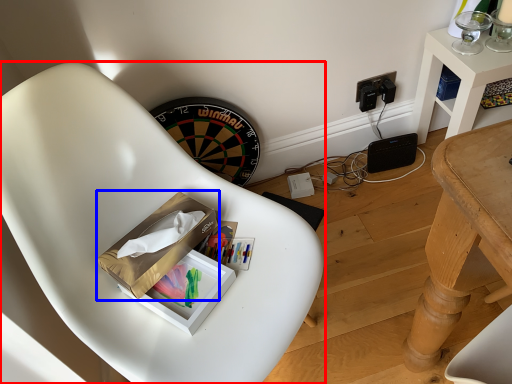
Question: Which point is further to the camera, chair (highlighted by a red box) or cardboard box (highlighted by a blue box)?

Choices:
 (A) chair
 (B) cardboard box

Answer: (B)